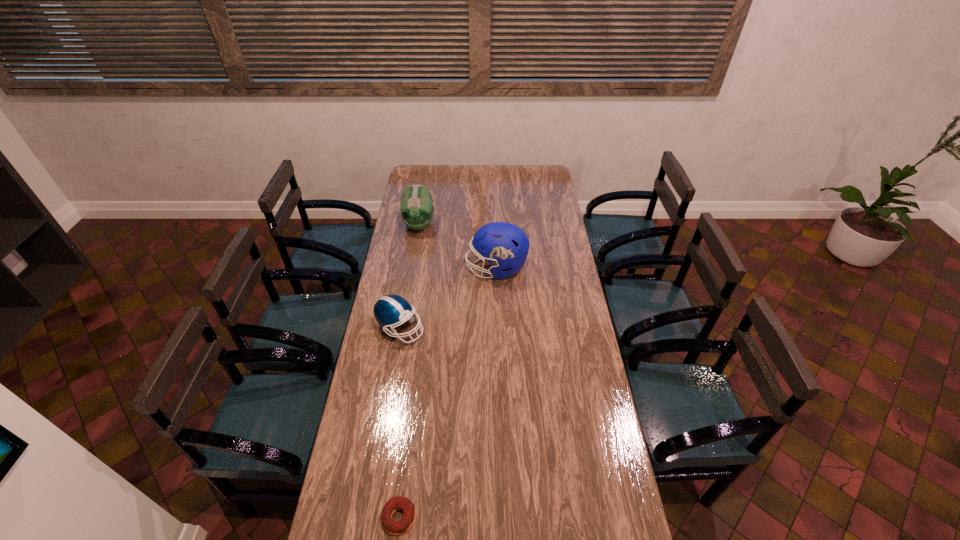
Where is `the rightmost object`? This screenshot has height=540, width=960. the rightmost object is located at coordinates (504, 245).

Where is `the second farthest object`? The height and width of the screenshot is (540, 960). the second farthest object is located at coordinates (504, 245).

The height and width of the screenshot is (540, 960). In order to click on the second tallest football helmet in this screenshot , I will do `click(416, 208)`.

You are a GUI agent. You are given a task and a screenshot of the screen. Output one action in this format:
    pyautogui.click(x=<x>, y=<y>)
    Task: Click on the farthest object
    
    Given the screenshot: What is the action you would take?
    pyautogui.click(x=416, y=208)

Locate an element on the screen. The image size is (960, 540). the second shortest object is located at coordinates (390, 310).

The width and height of the screenshot is (960, 540). What are the coordinates of `the shortest football helmet` in the screenshot? It's located at (390, 310).

This screenshot has width=960, height=540. Find the location of `the shortest object`. the shortest object is located at coordinates (401, 526).

Image resolution: width=960 pixels, height=540 pixels. Find the location of `doughnut`. doughnut is located at coordinates (401, 526).

Image resolution: width=960 pixels, height=540 pixels. What are the coordinates of `vacant space located on the front-facing side of the third nearest object` in the screenshot? It's located at (440, 268).

Identify the location of vacant area situated on the front-facing side of the third nearest object. (408, 268).